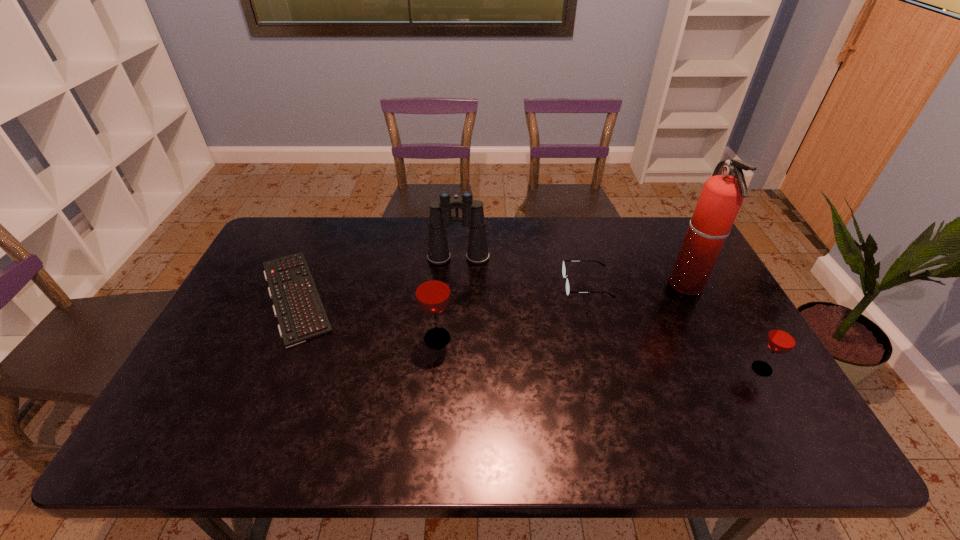
Point out which object is positioned as the nearest to the taller glass. Please provide its 2D coordinates. Your answer should be formatted as a tuple, i.e. [(x, y)], where the tuple contains the x and y coordinates of a point satisfying the conditions above.

[(297, 305)]

Where is `the third closest object relative to the binoculars`? the third closest object relative to the binoculars is located at coordinates (432, 289).

In order to click on free spot that satisfies the following two spatial constraints: 1. on the lenses of the nearer glass; 2. on the left side of the fifth tallest object in this screenshot , I will do `click(609, 369)`.